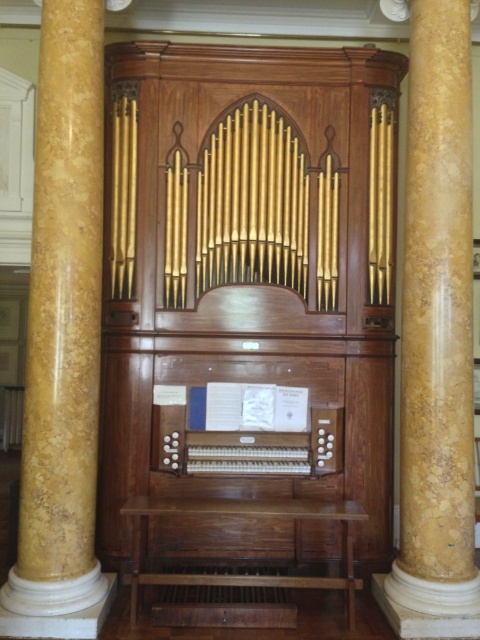
Between point (97, 282) and point (450, 352), which one is positioned in front?

Point (450, 352) is more forward.

Locate an element on the screen. The image size is (480, 640). marble column at center is located at coordinates (62, 332).

Based on the photo, can you confirm if marble column at center is bigger than wooden organ at center?

Yes, marble column at center is bigger than wooden organ at center.

Which of these two, marble column at center or wooden organ at center, stands shorter?

wooden organ at center

At what (x,y) coordinates should I click in order to perform the action: click on marble column at center. Please return your answer as a coordinate pair (x, y). Image resolution: width=480 pixels, height=640 pixels. Looking at the image, I should click on click(62, 332).

Which of these two, marble column at right or wooden organ at center, stands shorter?

With less height is wooden organ at center.

Is marble column at right bigger than wooden organ at center?

Yes.

Does point (452, 212) come farther from viewer compared to point (264, 465)?

No, (452, 212) is closer to viewer.

Where is `marble column at right`? marble column at right is located at coordinates (436, 323).